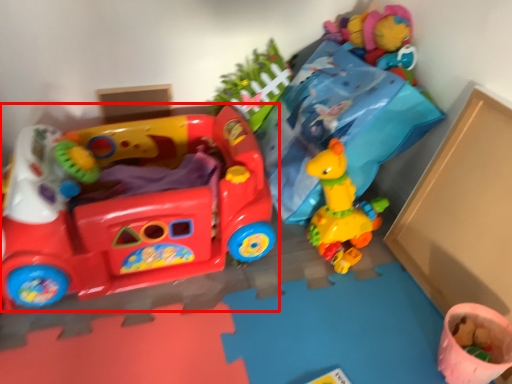
Question: From the image's perspective, what is the correct spatial positioning of toy (annotated by the red box) in reference to toy?

Choices:
 (A) above
 (B) below

Answer: (A)